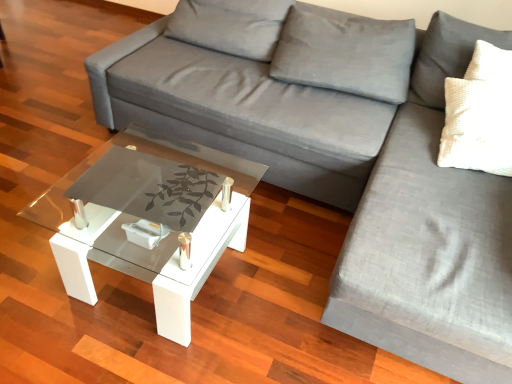
Question: Do you think gray fabric couch at center, the first couch when ordered from left to right, is within transparent glass coffee table at center, or outside of it?

Choices:
 (A) outside
 (B) inside

Answer: (A)

Question: Based on their sizes in the image, would you say gray fabric couch at center, which is the second couch in right-to-left order, is bigger or smaller than transparent glass coffee table at center?

Choices:
 (A) small
 (B) big

Answer: (B)

Question: Which of these objects is positioned closest to the gray fabric couch at right, which is the 1th couch from right to left?

Choices:
 (A) gray fabric couch at center, which is the second couch in right-to-left order
 (B) transparent glass coffee table at center

Answer: (A)

Question: Estimate the real-world distances between objects in this image. Which object is farther from the gray fabric couch at right, arranged as the 2th couch when viewed from the left?

Choices:
 (A) transparent glass coffee table at center
 (B) gray fabric couch at center, the first couch when ordered from left to right

Answer: (A)